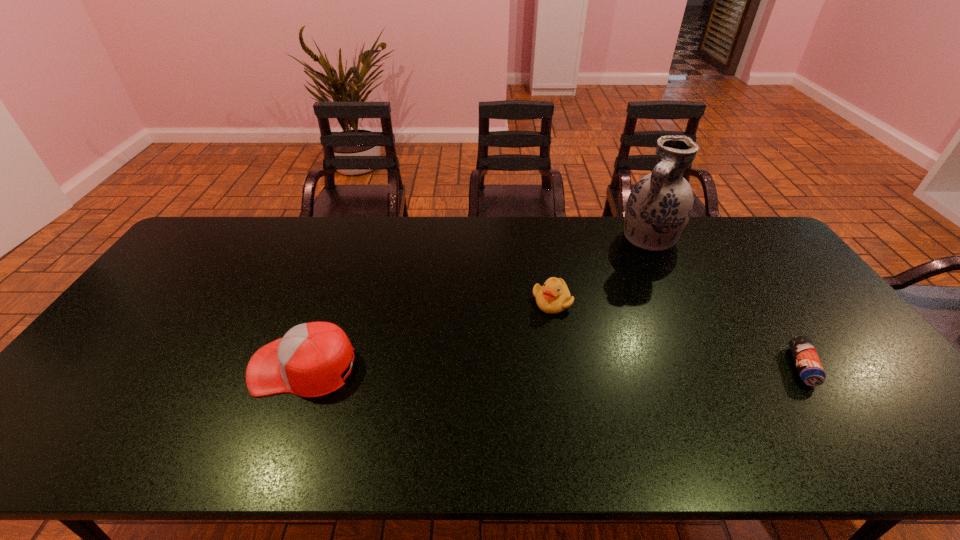
Find the location of a particular element. This screenshot has width=960, height=540. free space located 0.310m on the front-facing side of the baseball cap is located at coordinates (132, 367).

Find the location of a particular element. Image resolution: width=960 pixels, height=540 pixels. vacant point located 0.050m on the back of the beer can is located at coordinates (779, 332).

Identify the location of vacant point located 0.060m on the front-facing side of the second object from left to right. click(x=551, y=330).

Where is `free space located 0.100m on the front-facing side of the second object from left to right`? The height and width of the screenshot is (540, 960). free space located 0.100m on the front-facing side of the second object from left to right is located at coordinates (551, 341).

Locate an element on the screen. This screenshot has width=960, height=540. free space located on the front-facing side of the second object from left to right is located at coordinates (551, 341).

The height and width of the screenshot is (540, 960). Identify the location of free space located with the handle on the side of the vase. (626, 272).

At what (x,y) coordinates should I click in order to perform the action: click on vacant space located with the handle on the side of the vase. Please return your answer as a coordinate pair (x, y). Image resolution: width=960 pixels, height=540 pixels. Looking at the image, I should click on (626, 272).

Where is `free region located with the handle on the side of the vase`? This screenshot has width=960, height=540. free region located with the handle on the side of the vase is located at coordinates (610, 294).

Where is `object located in the far edge section of the desktop`? The image size is (960, 540). object located in the far edge section of the desktop is located at coordinates (659, 206).

I want to click on baseball cap located in the near edge section of the desktop, so click(x=308, y=361).